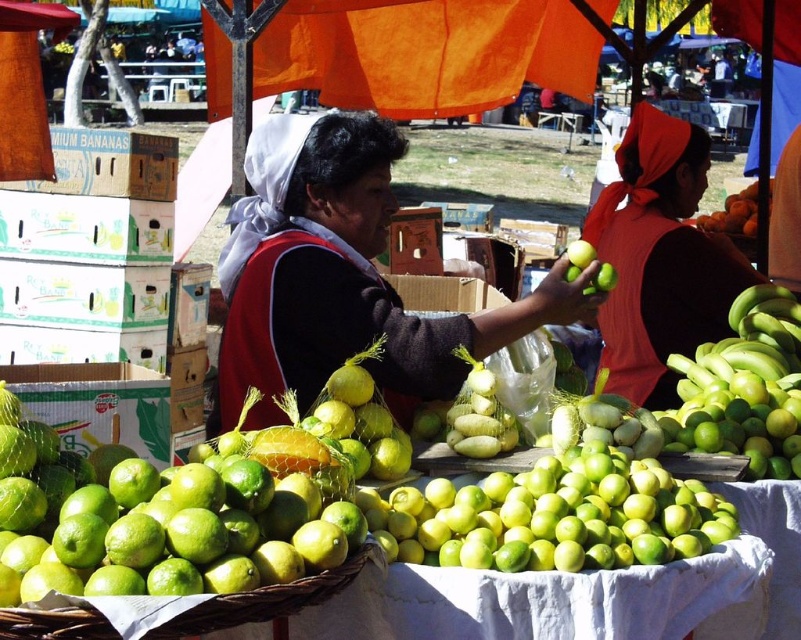
Question: Is green matte limes at center thinner than smooth orange pumpkin at center?

Choices:
 (A) yes
 (B) no

Answer: (B)

Question: Which is nearer to the green woven basket at lower left?

Choices:
 (A) green matte bananas at right
 (B) green matte limes at lower left
 (C) green matte limes at center

Answer: (B)

Question: Which of these objects is positioned farthest from the green matte limes at lower left?

Choices:
 (A) smooth orange pumpkin at center
 (B) green matte bananas at right

Answer: (A)

Question: Estimate the real-world distances between objects in this image. Which object is closer to the green woven basket at lower left?

Choices:
 (A) matte red vest at center
 (B) green matte bananas at right
 (C) green matte apple at center

Answer: (C)

Question: In this image, where is green matte limes at center located relative to green woven basket at lower left?

Choices:
 (A) below
 (B) above

Answer: (B)

Question: Is green matte limes at lower left behind green woven basket at lower left?

Choices:
 (A) yes
 (B) no

Answer: (A)